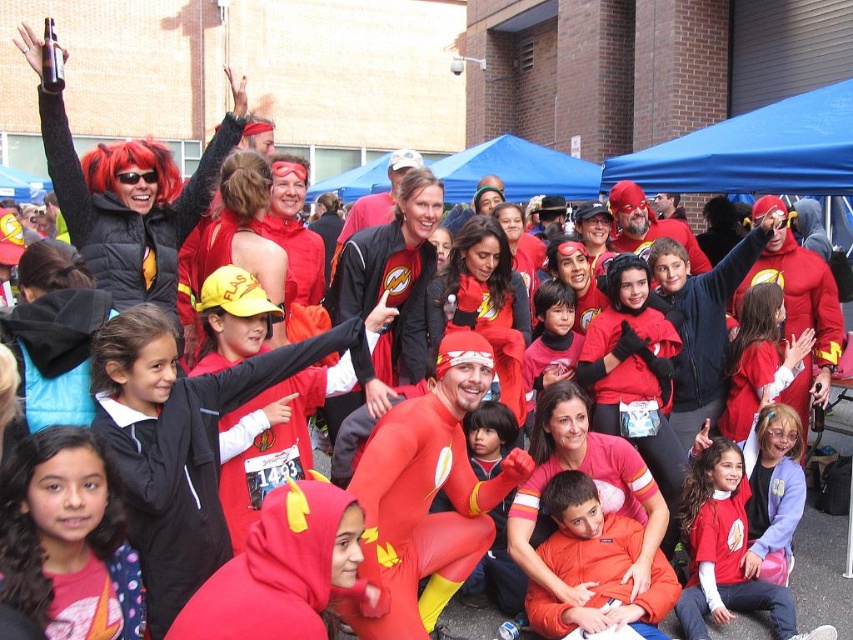
Does point (65, 545) come behind point (490, 576)?

No, it is not.

Is pink fleece hoodie at center above smooth red costume at center?

Correct, pink fleece hoodie at center is located above smooth red costume at center.

What do you see at coordinates (67, 536) in the screenshot?
I see `pink fleece hoodie at center` at bounding box center [67, 536].

You are a GUI agent. You are given a task and a screenshot of the screen. Output one action in this format:
    pyautogui.click(x=<x>, y=<y>)
    Task: Click on the pink fleece hoodie at center
    
    Given the screenshot: What is the action you would take?
    pyautogui.click(x=67, y=536)

Is matte red shirt at lower center positioned before matte red hoodie at center?

Yes.

Between matte red shirt at lower center and matte red hoodie at center, which one has less height?

matte red shirt at lower center is shorter.

Is point (701, 468) in front of point (741, 298)?

Yes, point (701, 468) is closer to viewer.

Find the location of a particular element. The image size is (853, 640). matte red shirt at lower center is located at coordinates (724, 548).

Is point (117, 584) farther from camera compared to point (730, 508)?

No, (117, 584) is closer to viewer.

Is pink fleece hoodie at center thinner than matte red shirt at lower center?

Yes, pink fleece hoodie at center is thinner than matte red shirt at lower center.

Between point (90, 522) and point (720, 458), which one is positioned behind?

Positioned behind is point (720, 458).

This screenshot has height=640, width=853. Find the location of `pink fleece hoodie at center`. pink fleece hoodie at center is located at coordinates (67, 536).